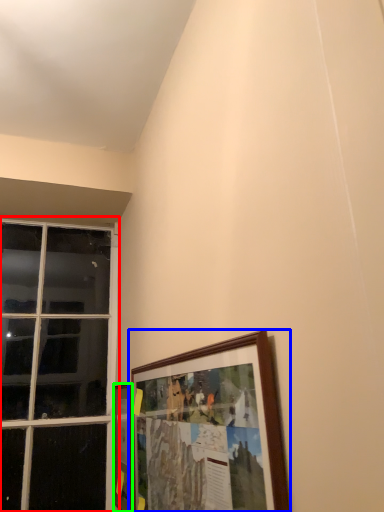
Question: Which object is positioned closest to window (highlighted by a red box)? Select from picture frame (highlighted by a blue box) and picture frame (highlighted by a green box).

Choices:
 (A) picture frame
 (B) picture frame

Answer: (B)